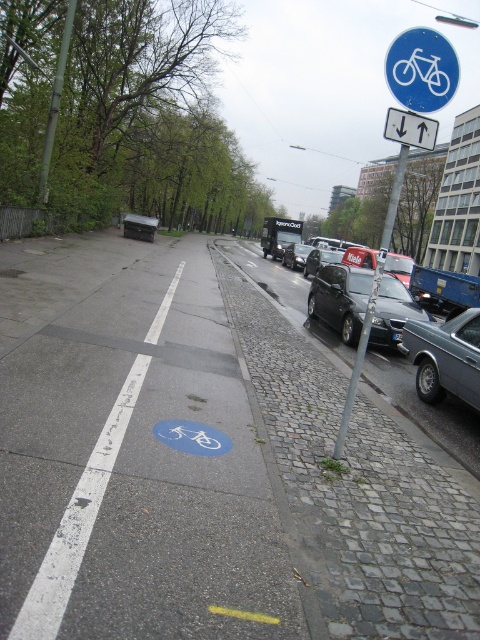
You are standing at the intersection and want to cross the road to reach the shiny black sedan at center. Which direction should you walk to get there?

The shiny black sedan at center is located at point coordinates of (339, 298), so you should walk towards the center of the image to reach it.

You are standing at the intersection and want to determine which of the two points, point (428, 316) or point (408, 326), is closer to you. Based on the scene, which point is nearer?

Point (428, 316) is closer to you than point (408, 326) because it is further to the viewer in the image.